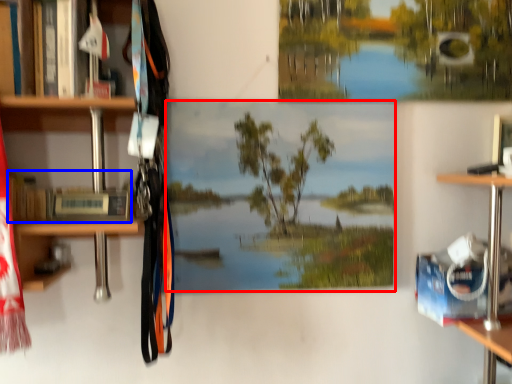
Question: Among these objects, which one is farthest to the camera, mural (highlighted by a red box) or book (highlighted by a blue box)?

Choices:
 (A) mural
 (B) book

Answer: (A)